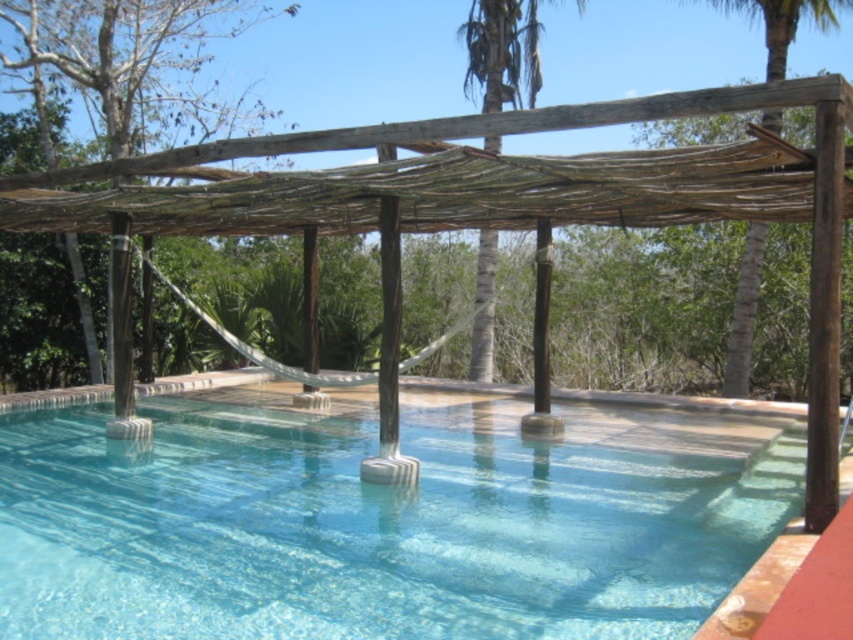
You are standing at the entrance of the pool area and want to walk directly to the clear glass pool at center. According to the coordinates provided, in which direction should you move relative to your current position?

The clear glass pool at center is located at point 0.814 on the x and 0.451 on the y coordinate. Since you are at the entrance, which is likely positioned at a lower coordinate, you should move towards increasing x and y coordinates to reach the pool.

You are standing at the edge of the clear glass pool at center and want to look towards the brown wood palm tree at upper right. Which direction should you turn your head to see it?

The brown wood palm tree at upper right is behind the clear glass pool at center, so you need to turn your head backward to see it.